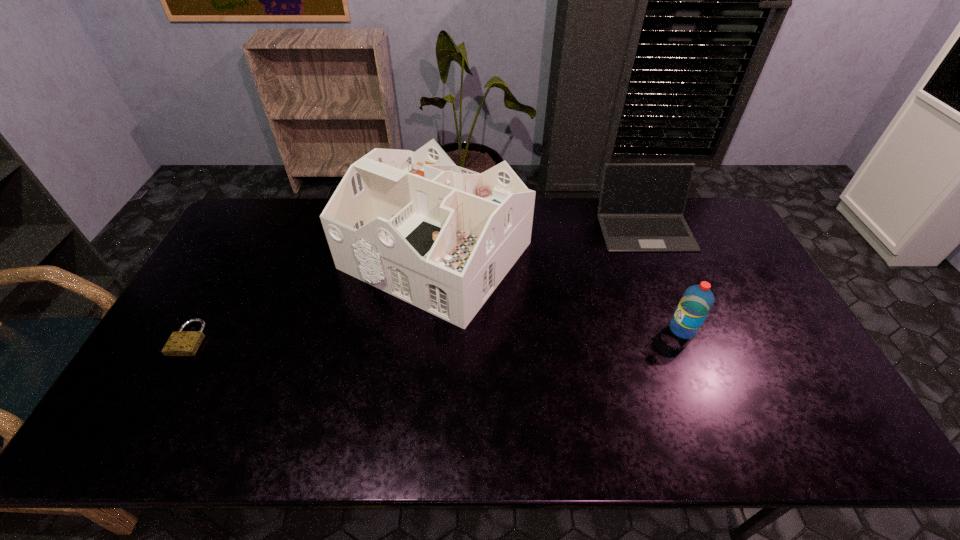
This screenshot has height=540, width=960. In order to click on vacant space located 0.320m on the front label of the water bottle in this screenshot , I will do `click(556, 329)`.

What are the coordinates of `free space located 0.110m on the keyhole side of the shortest object` in the screenshot? It's located at (159, 393).

This screenshot has width=960, height=540. Identify the location of dollhouse present at the far edge. (441, 237).

Image resolution: width=960 pixels, height=540 pixels. In order to click on laptop that is at the far edge in this screenshot , I will do `click(641, 206)`.

Find the location of a particular element. The image size is (960, 540). object positioned at the left edge is located at coordinates (182, 343).

Find the location of a particular element. The height and width of the screenshot is (540, 960). object at the right edge is located at coordinates (641, 206).

At what (x,y) coordinates should I click in order to perform the action: click on object that is at the far right corner. Please return your answer as a coordinate pair (x, y). Looking at the image, I should click on (641, 206).

Locate an element on the screen. This screenshot has height=540, width=960. vacant space at the near edge is located at coordinates (285, 444).

Locate an element on the screen. vacant area at the left edge of the desktop is located at coordinates (159, 396).

This screenshot has width=960, height=540. Find the location of `free spot at the right edge of the desktop`. free spot at the right edge of the desktop is located at coordinates (740, 255).